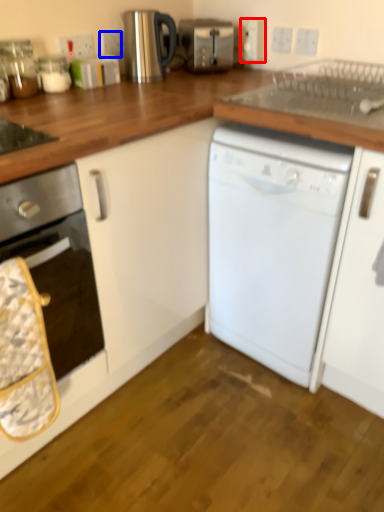
Question: Which object is closer to the camera taking this photo, electric outlet (highlighted by a red box) or electric outlet (highlighted by a blue box)?

Choices:
 (A) electric outlet
 (B) electric outlet

Answer: (B)